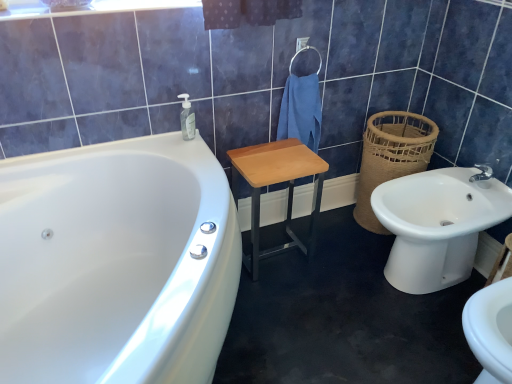
The image size is (512, 384). I want to click on vacant region in front of wooden/matte step stool at center, so click(x=288, y=299).